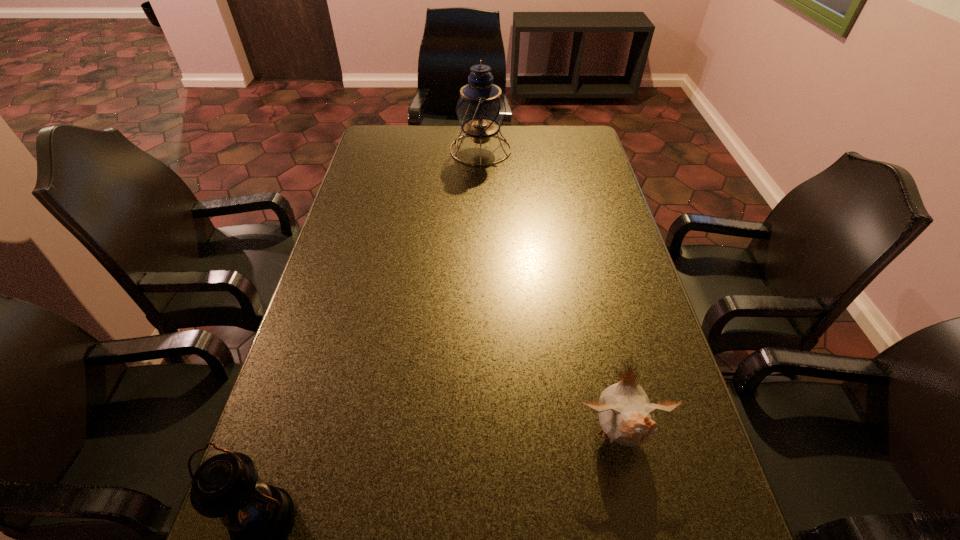
Locate an element on the screen. the right lantern is located at coordinates (480, 109).

The image size is (960, 540). In order to click on the second object from right to left in this screenshot , I will do `click(480, 109)`.

Locate an element on the screen. The image size is (960, 540). bird is located at coordinates (626, 416).

The height and width of the screenshot is (540, 960). I want to click on the rightmost object, so click(x=626, y=416).

The width and height of the screenshot is (960, 540). Find the location of `free space located 0.140m on the front-facing side of the farthest object`. free space located 0.140m on the front-facing side of the farthest object is located at coordinates (413, 150).

I want to click on free space located 0.110m on the front-facing side of the farthest object, so click(420, 150).

What are the coordinates of `vacant space located on the front-facing side of the farthest object` in the screenshot? It's located at pyautogui.click(x=369, y=150).

Where is `vacant position located at the beak of the shortest object`? Image resolution: width=960 pixels, height=540 pixels. vacant position located at the beak of the shortest object is located at coordinates (636, 507).

Locate an element on the screen. object located in the far edge section of the desktop is located at coordinates (480, 109).

Identify the location of object that is at the right edge. This screenshot has width=960, height=540. [x=626, y=416].